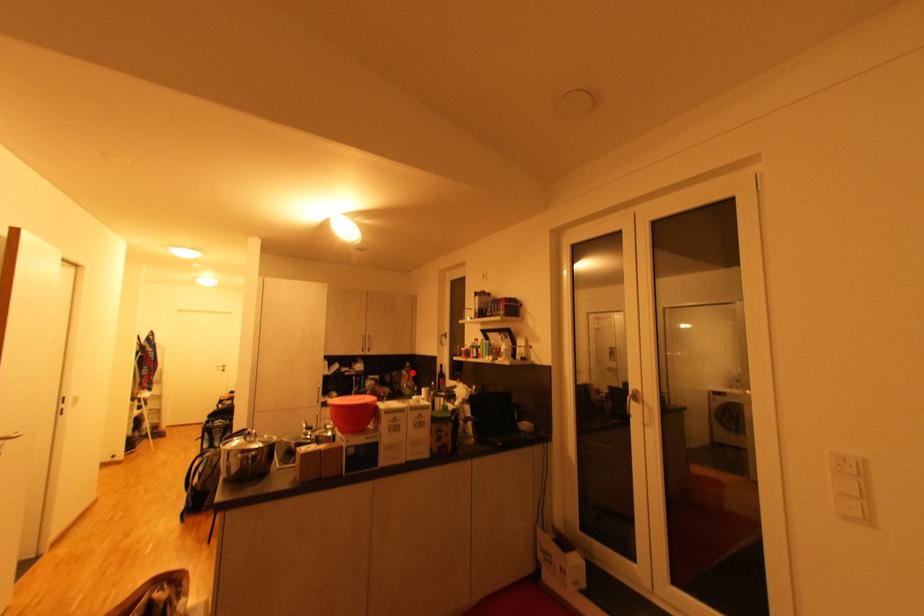
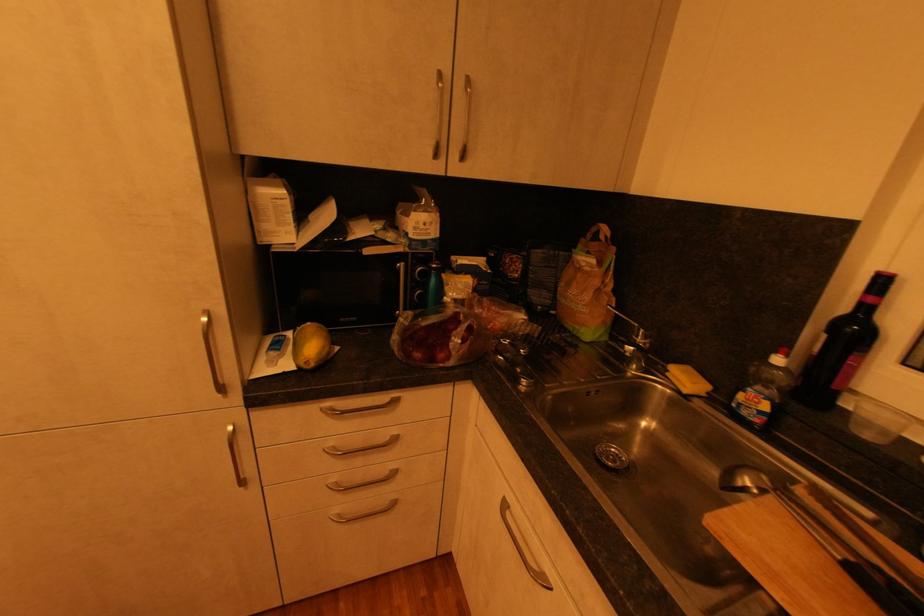
Question: I am providing you with two images of the same scene from different viewpoints. A red point is shown in image1. For the corresponding object point in image2, is it positioned nearer or farther from the camera?

Choices:
 (A) Nearer
 (B) Farther

Answer: (A)